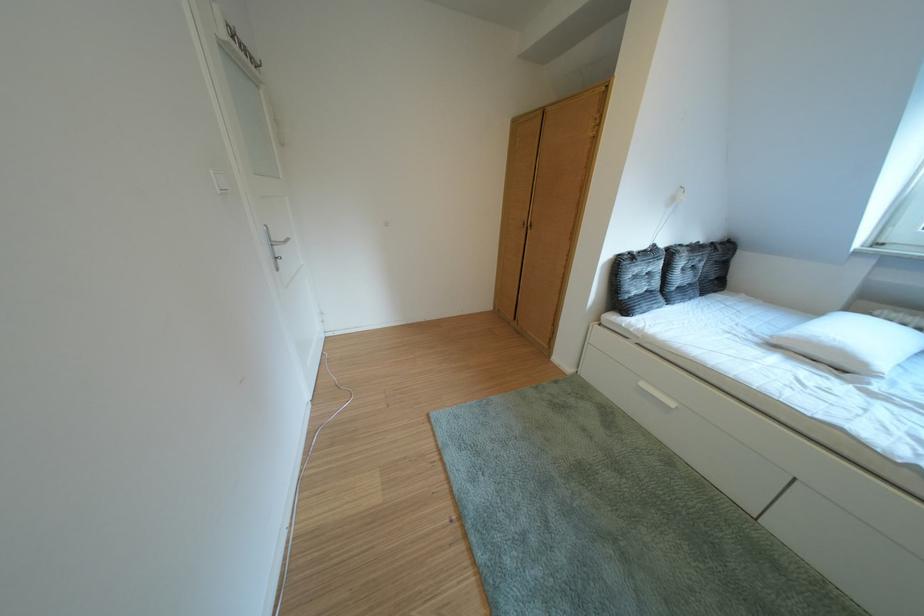
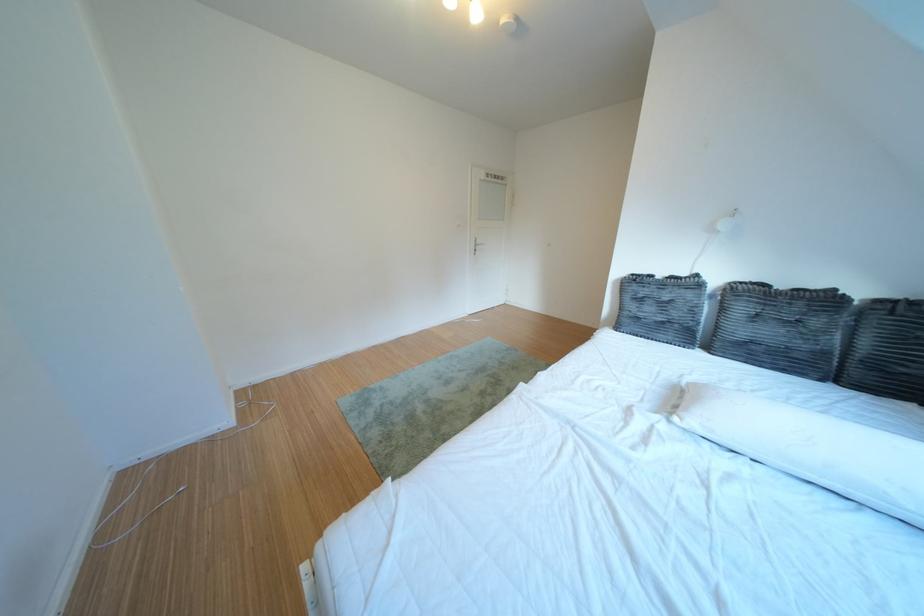
The point at (726, 249) is marked in the first image. Where is the corresponding point in the second image?

(910, 306)